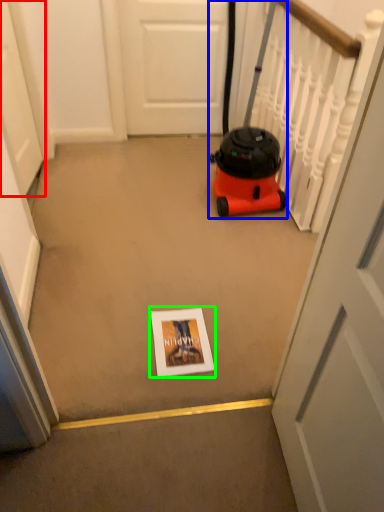
Question: Based on their relative distances, which object is farther from door (highlighted by a red box)? Choose from equipment (highlighted by a blue box) and copy (highlighted by a green box).

Choices:
 (A) equipment
 (B) copy

Answer: (B)